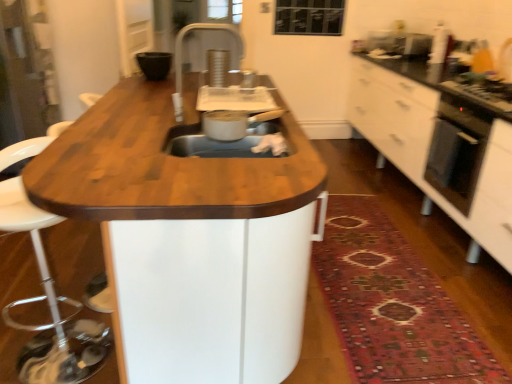
What do you see at coordinates (50, 306) in the screenshot?
I see `wooden swivel chair at left` at bounding box center [50, 306].

At what (x,y) coordinates should I click in order to perform the action: click on wooden swivel chair at left. Please return your answer as a coordinate pair (x, y). This screenshot has width=512, height=384. Looking at the image, I should click on (50, 306).

Describe the element at coordinates (439, 146) in the screenshot. I see `white glossy cabinet at right` at that location.

Describe the element at coordinates (457, 149) in the screenshot. This screenshot has height=384, width=512. I see `black glass oven at right` at that location.

The image size is (512, 384). I want to click on black glass oven at right, so click(457, 149).

Measure the distance between silver metallic faucet at upper center and camera.

1.75 meters.

This screenshot has width=512, height=384. What are the coordinates of `black glass gas stove at right` in the screenshot? It's located at (x=483, y=92).

Measure the distance between black glass gas stove at right and camera.

black glass gas stove at right is 2.05 meters from camera.

What is the approximate width of metallic silver pot at center sink?

It is 14.32 inches.

The width and height of the screenshot is (512, 384). What do you see at coordinates (154, 64) in the screenshot?
I see `black matte bowl at upper center` at bounding box center [154, 64].

The height and width of the screenshot is (384, 512). Find the location of `black matte bowl at upper center`. black matte bowl at upper center is located at coordinates (154, 64).

Describe the element at coordinates (189, 239) in the screenshot. I see `wooden table at center` at that location.

The width and height of the screenshot is (512, 384). In order to click on wooden swivel chair at left in this screenshot , I will do `click(50, 306)`.

Considering the positions of objects wooden swivel chair at left and wooden table at center in the image provided, who is more to the right, wooden swivel chair at left or wooden table at center?

From the viewer's perspective, wooden table at center appears more on the right side.

From the picture: Is wooden swivel chair at left inside the boundaries of wooden table at center, or outside?

wooden swivel chair at left is not inside wooden table at center, it's outside.

Which is more distant, (5, 228) or (233, 325)?

The point (5, 228) is farther from the camera.

Is wooden swivel chair at left touching wooden table at center?

wooden swivel chair at left and wooden table at center are not in contact.

Which of these two, silver metallic faucet at upper center or metallic silver pot at center sink, is smaller?

With smaller size is silver metallic faucet at upper center.

Is silver metallic faucet at upper center to the left or to the right of metallic silver pot at center sink in the image?

silver metallic faucet at upper center is positioned on metallic silver pot at center sink's left side.

Which is in front, silver metallic faucet at upper center or metallic silver pot at center sink?

Positioned in front is silver metallic faucet at upper center.

Considering the sizes of objects metallic silver pot at center sink and wooden swivel chair at left in the image provided, who is taller, metallic silver pot at center sink or wooden swivel chair at left?

wooden swivel chair at left is taller.

Is metallic silver pot at center sink completely or partially outside of wooden swivel chair at left?

Absolutely, metallic silver pot at center sink is external to wooden swivel chair at left.

How many degrees apart are the facing directions of metallic silver pot at center sink and wooden swivel chair at left?

90 degrees.

Which object is positioned more to the right, metallic silver pot at center sink or wooden swivel chair at left?

metallic silver pot at center sink.

Which object is closer to the camera, white glossy cabinet at right or black matte bowl at upper center?

white glossy cabinet at right is in front.

Considering the positions of objects white glossy cabinet at right and black matte bowl at upper center in the image provided, who is more to the right, white glossy cabinet at right or black matte bowl at upper center?

white glossy cabinet at right is more to the right.

You are a GUI agent. You are given a task and a screenshot of the screen. Output one action in this format:
    pyautogui.click(x=<x>, y=<y>)
    Task: Click on the appliance above the white glossy cabinet at right (from the image's perspective)
    The image size is (512, 384).
    Given the screenshot: What is the action you would take?
    pyautogui.click(x=154, y=64)

From a real-world perspective, which object rests below the other?

In real-world perspective, white glossy cabinet at right is lower.

Is point (460, 174) closer or farther from the camera than point (85, 122)?

Point (460, 174) is farther from the camera than point (85, 122).

Is black glass oven at right wider than wooden table at center?

In fact, black glass oven at right might be narrower than wooden table at center.

Relative to wooden table at center, is black glass oven at right in front or behind?

Visually, black glass oven at right is located behind wooden table at center.

Is metallic silver pot at center sink located within black glass oven at right?

No, metallic silver pot at center sink is not a part of black glass oven at right.

Considering the relative positions of black glass oven at right and metallic silver pot at center sink in the image provided, is black glass oven at right to the left or to the right of metallic silver pot at center sink?

black glass oven at right is to the right of metallic silver pot at center sink.

Considering the points (455, 188) and (269, 112), which point is behind, point (455, 188) or point (269, 112)?

The point (455, 188) is farther.

Looking at this image, how far apart are silver metallic faucet at upper center and white glossy cabinet at right?

A distance of 4.82 feet exists between silver metallic faucet at upper center and white glossy cabinet at right.

Does silver metallic faucet at upper center come behind white glossy cabinet at right?

No, it is in front of white glossy cabinet at right.

Which object is thinner, silver metallic faucet at upper center or white glossy cabinet at right?

silver metallic faucet at upper center is thinner.

Which point is more forward, (181, 106) or (375, 121)?

The point (181, 106) is closer to the camera.

Where is `swivel chair that is behind the wooden table at center`? This screenshot has width=512, height=384. swivel chair that is behind the wooden table at center is located at coordinates (50, 306).

In the image, there is a silver metallic faucet at upper center. Where is `kitchen appliance below it (from the image's perspective)`? The image size is (512, 384). kitchen appliance below it (from the image's perspective) is located at coordinates (233, 123).

Looking at the image, which one is located closer to black glass gas stove at right, white glossy cabinet at right or black matte bowl at upper center?

Based on the image, white glossy cabinet at right appears to be nearer to black glass gas stove at right.

Which object lies nearer to the anchor point silver metallic faucet at upper center, wooden swivel chair at left or white glossy cabinet at right?

Based on the image, wooden swivel chair at left appears to be nearer to silver metallic faucet at upper center.

Which object lies nearer to the anchor point white glossy cabinet at right, silver metallic faucet at upper center or wooden swivel chair at left?

Among the two, silver metallic faucet at upper center is located nearer to white glossy cabinet at right.

Estimate the real-world distances between objects in this image. Which object is closer to black matte bowl at upper center, wooden swivel chair at left or black glass oven at right?

The object closer to black matte bowl at upper center is wooden swivel chair at left.

Looking at the image, which one is located further to white glossy cabinet at right, metallic silver pot at center sink or black matte bowl at upper center?

black matte bowl at upper center lies further to white glossy cabinet at right than the other object.

Estimate the real-world distances between objects in this image. Which object is further from wooden swivel chair at left, wooden table at center or silver metallic faucet at upper center?

silver metallic faucet at upper center.

Estimate the real-world distances between objects in this image. Which object is further from wooden swivel chair at left, black matte bowl at upper center or metallic silver pot at center sink?

Among the two, black matte bowl at upper center is located further to wooden swivel chair at left.

When comparing their distances from wooden table at center, does black glass gas stove at right or wooden swivel chair at left seem closer?

wooden swivel chair at left.

Find the location of `table between wooden swivel chair at left and black glass oven at right`. table between wooden swivel chair at left and black glass oven at right is located at coordinates (189, 239).

At what (x,y) coordinates should I click in order to perform the action: click on kitchen appliance between silver metallic faucet at upper center and black glass oven at right in the horizontal direction. Please return your answer as a coordinate pair (x, y). Looking at the image, I should click on (233, 123).

Image resolution: width=512 pixels, height=384 pixels. Find the location of `faucet located between wooden table at center and metallic silver pot at center sink in the depth direction`. faucet located between wooden table at center and metallic silver pot at center sink in the depth direction is located at coordinates (181, 57).

Image resolution: width=512 pixels, height=384 pixels. I want to click on kitchen appliance between wooden swivel chair at left and black glass gas stove at right, so click(x=233, y=123).